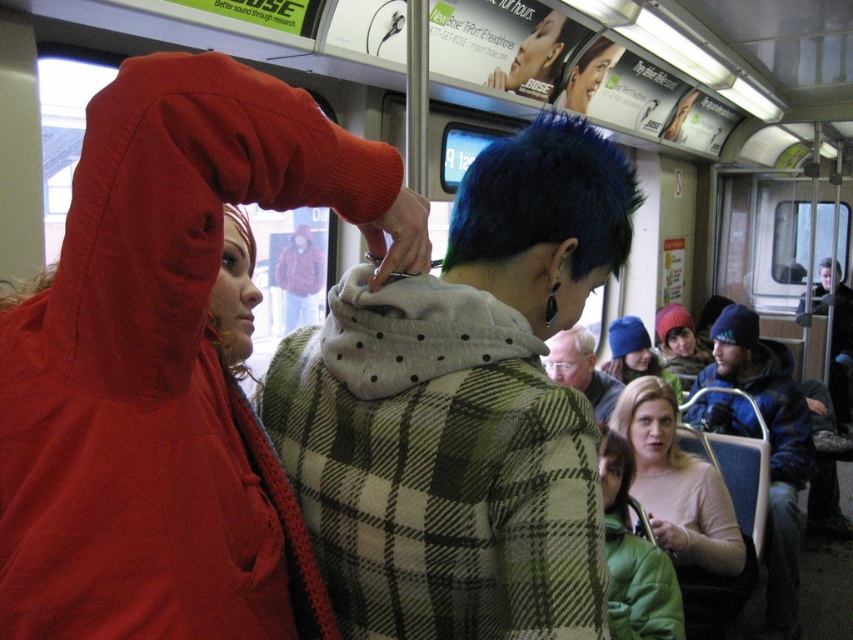
Is blue knit cap at upper right closer to the viewer compared to dark blue knit cap at upper right?

Yes.

Can you confirm if blue knit cap at upper right is shorter than dark blue knit cap at upper right?

Yes.

You are a GUI agent. You are given a task and a screenshot of the screen. Output one action in this format:
    pyautogui.click(x=<x>, y=<y>)
    Task: Click on the blue knit cap at upper right
    Image resolution: width=853 pixels, height=640 pixels.
    Given the screenshot: What is the action you would take?
    pyautogui.click(x=769, y=448)

Locate an element on the screen. Image resolution: width=853 pixels, height=640 pixels. blue knit cap at upper right is located at coordinates (769, 448).

Is point (589, 154) positioned before point (498, 202)?

No.

Between polka dot hoodie at center and blue spiky hair at upper center, which one has more height?

polka dot hoodie at center is taller.

The height and width of the screenshot is (640, 853). I want to click on polka dot hoodie at center, so click(x=463, y=410).

Where is `polka dot hoodie at center`? polka dot hoodie at center is located at coordinates [463, 410].

How distant is polka dot hoodie at center from green fuzzy jacket at lower right?

polka dot hoodie at center and green fuzzy jacket at lower right are 1.11 meters apart.

Is point (537, 618) positioned in front of point (630, 573)?

Yes, it is in front of point (630, 573).

Locate an element on the screen. polka dot hoodie at center is located at coordinates (463, 410).